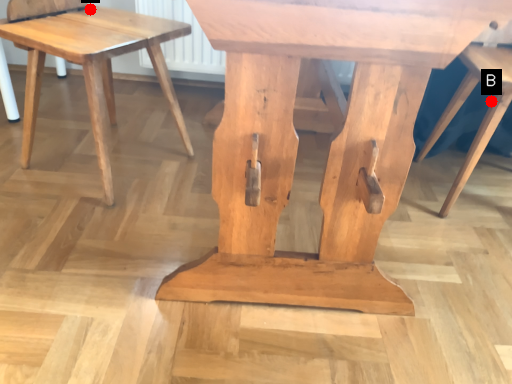
Question: Two points are circled on the image, labeled by A and B beside each circle. Which of the following is the farthest from the observer?

Choices:
 (A) A is further
 (B) B is further

Answer: (B)